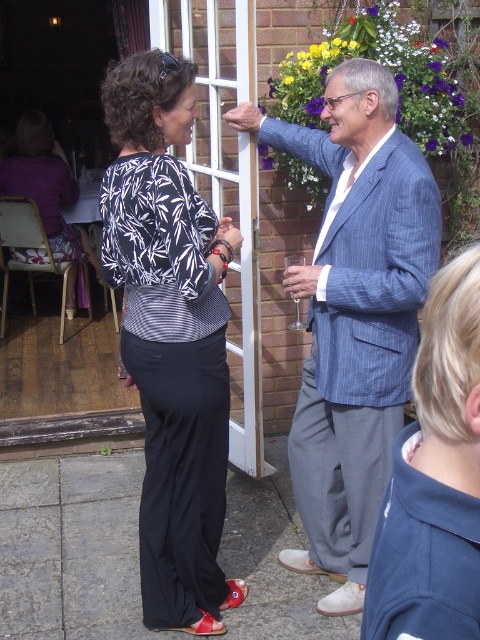
You are organizing a charity event and need to ensure all donated clothing items fit in a standard donation box. The box can only accommodate items smaller than the matte black pants at center. Do you think the blue striped blazer at upper right will fit in the box?

The blue striped blazer at upper right is bigger than the matte black pants at center. Since the donation box can only hold items smaller than the matte black pants at center, the blue striped blazer at upper right will not fit in the box.

You are at a social gathering and see two people talking. The woman on the left is wearing black and white striped clothing with red sandals, and the man on the right is in a blue pinstripe suit. There is a point marked at coordinates (170, 337). What object is located at that point?

The point at coordinates (170, 337) indicates matte black pants at center.

You are at a party and want to take a photo of the blonde hair at right and the white glass screen door at upper center. Which object is narrower when framing the shot?

The blonde hair at right is thinner than the white glass screen door at upper center, so it is narrower when framing the shot.